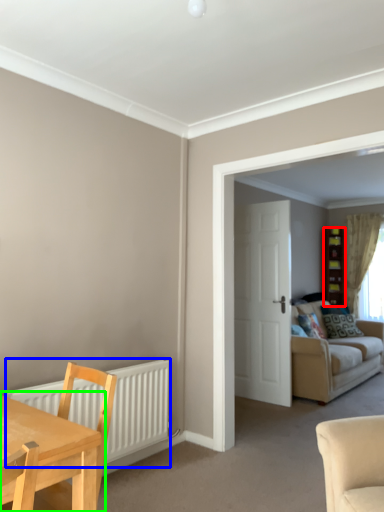
Question: Based on their relative distances, which object is nearer to cabinetry (highlighted by a red box)? Choose from radiator (highlighted by a blue box) and table (highlighted by a green box).

Choices:
 (A) radiator
 (B) table

Answer: (A)